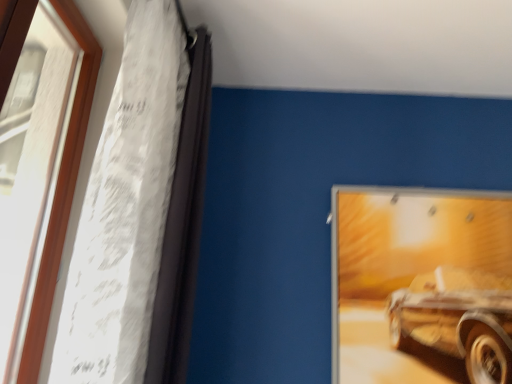
Question: Does white sheer fabric at left appear on the left side of metallic silver picture frame at upper right?

Choices:
 (A) yes
 (B) no

Answer: (A)

Question: Would you say white sheer fabric at left contains metallic silver picture frame at upper right?

Choices:
 (A) no
 (B) yes

Answer: (A)

Question: Is white sheer fabric at left thinner than metallic silver picture frame at upper right?

Choices:
 (A) no
 (B) yes

Answer: (A)

Question: From a real-world perspective, is white sheer fabric at left located beneath metallic silver picture frame at upper right?

Choices:
 (A) yes
 (B) no

Answer: (B)

Question: From the image's perspective, is white sheer fabric at left below metallic silver picture frame at upper right?

Choices:
 (A) yes
 (B) no

Answer: (B)

Question: Considering the positions of wooden frame at left and metallic silver picture frame at upper right in the image, is wooden frame at left bigger or smaller than metallic silver picture frame at upper right?

Choices:
 (A) small
 (B) big

Answer: (B)

Question: Relative to metallic silver picture frame at upper right, is wooden frame at left in front or behind?

Choices:
 (A) behind
 (B) front

Answer: (B)

Question: Is wooden frame at left inside the boundaries of metallic silver picture frame at upper right, or outside?

Choices:
 (A) inside
 (B) outside

Answer: (B)

Question: From a real-world perspective, is wooden frame at left physically located above or below metallic silver picture frame at upper right?

Choices:
 (A) above
 (B) below

Answer: (A)

Question: From a real-world perspective, is white sheer fabric at left positioned above or below wooden frame at left?

Choices:
 (A) below
 (B) above

Answer: (B)

Question: From the image's perspective, relative to wooden frame at left, is white sheer fabric at left above or below?

Choices:
 (A) above
 (B) below

Answer: (A)

Question: Looking at the image, does white sheer fabric at left seem bigger or smaller compared to wooden frame at left?

Choices:
 (A) big
 (B) small

Answer: (A)

Question: Considering their positions, is white sheer fabric at left located in front of or behind wooden frame at left?

Choices:
 (A) behind
 (B) front

Answer: (A)

Question: Is wooden frame at left bigger or smaller than white sheer fabric at left?

Choices:
 (A) small
 (B) big

Answer: (A)

Question: From their relative heights in the image, would you say wooden frame at left is taller or shorter than white sheer fabric at left?

Choices:
 (A) tall
 (B) short

Answer: (B)